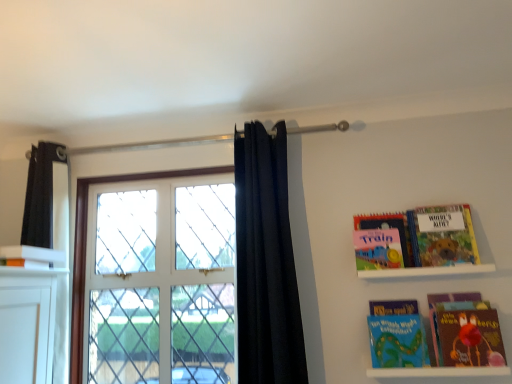
Describe the element at coordinates (266, 262) in the screenshot. The height and width of the screenshot is (384, 512). I see `black fabric curtain at center` at that location.

Where is `matte red book at lower right`? matte red book at lower right is located at coordinates (449, 309).

What do you see at coordinates (382, 241) in the screenshot? I see `matte pink book at upper right, placed as the 2th book when sorted from left to right` at bounding box center [382, 241].

You are a GUI agent. You are given a task and a screenshot of the screen. Output one action in this format:
    pyautogui.click(x=<x>, y=<y>)
    Task: Click on the white glossy book at upper left, which ranks as the 4th book in right-to-left order
    Image resolution: width=512 pixels, height=384 pixels.
    Given the screenshot: What is the action you would take?
    pyautogui.click(x=30, y=256)

How much space does white matte shelf at lower right, marked as the 1th shelf in a bottom-to-top arrangement, occupy horizontally?

It is 4.93 inches.

Locate an element on the screen. This screenshot has height=384, width=512. blue matte bookshelf at lower right, the second book viewed from the right is located at coordinates (397, 335).

Does matte pink book at upper right, placed as the 2th book when sorted from left to right, have a greater height compared to matte red book at lower right?

No.

Is point (398, 248) behind point (464, 309)?

Yes, point (398, 248) is behind point (464, 309).

Considering the relative sizes of matte pink book at upper right, the third book in the right-to-left sequence, and matte red book at lower right in the image provided, is matte pink book at upper right, the third book in the right-to-left sequence, thinner than matte red book at lower right?

Correct, the width of matte pink book at upper right, the third book in the right-to-left sequence, is less than that of matte red book at lower right.

Is matte pink book at upper right, the third book in the right-to-left sequence, at the left side of matte red book at lower right?

Yes.

From a real-world perspective, which object stands above the other?

In real-world perspective, white matte shelf at upper right, the 1th shelf viewed from the top, is above.

Is white matte shelf at upper right, the 1th shelf viewed from the top, positioned behind white matte shelf at lower right, marked as the 1th shelf in a bottom-to-top arrangement?

Yes, white matte shelf at upper right, the 1th shelf viewed from the top, is further from the viewer.

How different are the orientations of white matte shelf at upper right, acting as the second shelf starting from the bottom, and white matte shelf at lower right, the 2th shelf in the top-to-bottom sequence, in degrees?

The angle between the facing direction of white matte shelf at upper right, acting as the second shelf starting from the bottom, and the facing direction of white matte shelf at lower right, the 2th shelf in the top-to-bottom sequence, is 0.00754 degrees.

Identify the location of shelf that appears above the white matte shelf at lower right, the 2th shelf in the top-to-bottom sequence (from a real-world perspective). (426, 271).

Can we say white glass window at center lies outside black fabric curtain at center?

white glass window at center lies outside black fabric curtain at center's area.

Considering the relative positions of white glass window at center and black fabric curtain at center in the image provided, is white glass window at center to the left or to the right of black fabric curtain at center?

white glass window at center is positioned on black fabric curtain at center's left side.

Is white glass window at center positioned before black fabric curtain at center?

No, it is not.

Is white glass window at center with black fabric curtain at center?

No, white glass window at center is not in contact with black fabric curtain at center.

Can you confirm if blue matte bookshelf at lower right, the second book viewed from the right, is positioned to the left of white matte shelf at lower right, the 2th shelf in the top-to-bottom sequence?

Yes, blue matte bookshelf at lower right, the second book viewed from the right, is to the left of white matte shelf at lower right, the 2th shelf in the top-to-bottom sequence.

Where is `shelf below the blue matte bookshelf at lower right, the second book viewed from the right (from the image's perspective)`? The image size is (512, 384). shelf below the blue matte bookshelf at lower right, the second book viewed from the right (from the image's perspective) is located at coordinates (438, 372).

Is blue matte bookshelf at lower right, the second book viewed from the right, touching white matte shelf at lower right, marked as the 1th shelf in a bottom-to-top arrangement?

There is a gap between blue matte bookshelf at lower right, the second book viewed from the right, and white matte shelf at lower right, marked as the 1th shelf in a bottom-to-top arrangement.

Which object is closer to the camera, blue matte bookshelf at lower right, the second book viewed from the right, or white matte shelf at lower right, marked as the 1th shelf in a bottom-to-top arrangement?

white matte shelf at lower right, marked as the 1th shelf in a bottom-to-top arrangement, is more forward.

From a real-world perspective, is white glass window at center positioned over blue matte bookshelf at lower right, the third book from the left, based on gravity?

Correct, in the physical world, white glass window at center is higher than blue matte bookshelf at lower right, the third book from the left.

Which of these two, white glass window at center or blue matte bookshelf at lower right, the second book viewed from the right, is bigger?

white glass window at center.

Can you tell me how much white glass window at center and blue matte bookshelf at lower right, the second book viewed from the right, differ in facing direction?

There is a 0.839-degree angle between the facing directions of white glass window at center and blue matte bookshelf at lower right, the second book viewed from the right.

Does point (79, 334) lie behind point (398, 334)?

Yes, point (79, 334) is farther from viewer.

Which is more distant, (419, 233) or (79, 333)?

Positioned behind is point (79, 333).

I want to click on window that is on the left side of hardcover book at upper right, which is the 1th book from right to left, so click(86, 247).

From the image's perspective, is hardcover book at upper right, which appears as the 4th book when viewed from the left, beneath white glass window at center?

No.

Is hardcover book at upper right, which appears as the 4th book when viewed from the left, to the right of white glass window at center from the viewer's perspective?

Yes, hardcover book at upper right, which appears as the 4th book when viewed from the left, is to the right of white glass window at center.

Who is bigger, blue matte bookshelf at lower right, the second book viewed from the right, or white glossy book at upper left, which ranks as the 4th book in right-to-left order?

With larger size is blue matte bookshelf at lower right, the second book viewed from the right.

Locate an element on the screen. The width and height of the screenshot is (512, 384). book in front of the blue matte bookshelf at lower right, the second book viewed from the right is located at coordinates (30, 256).

From the image's perspective, is blue matte bookshelf at lower right, the second book viewed from the right, on top of white glossy book at upper left, which appears as the 1th book when viewed from the left?

Actually, blue matte bookshelf at lower right, the second book viewed from the right, appears below white glossy book at upper left, which appears as the 1th book when viewed from the left, in the image.

The height and width of the screenshot is (384, 512). Identify the location of book that is the 2nd one when counting upward from the matte red book at lower right (from the image's perspective). (382, 241).

Locate an element on the screen. shelf in front of the white matte shelf at upper right, the 1th shelf viewed from the top is located at coordinates (438, 372).

Looking at the image, which one is located closer to white glossy book at upper left, which appears as the 1th book when viewed from the left, blue matte bookshelf at lower right, the second book viewed from the right, or white glass window at center?

Based on the image, white glass window at center appears to be nearer to white glossy book at upper left, which appears as the 1th book when viewed from the left.

Based on their spatial positions, is white glossy book at upper left, which appears as the 1th book when viewed from the left, or matte pink book at upper right, the third book in the right-to-left sequence, further from white matte shelf at lower right, marked as the 1th shelf in a bottom-to-top arrangement?

The object further to white matte shelf at lower right, marked as the 1th shelf in a bottom-to-top arrangement, is white glossy book at upper left, which appears as the 1th book when viewed from the left.

Considering their positions, is blue matte bookshelf at lower right, the third book from the left, positioned closer to hardcover book at upper right, which appears as the 4th book when viewed from the left, than black fabric curtain at center?

The object closer to hardcover book at upper right, which appears as the 4th book when viewed from the left, is blue matte bookshelf at lower right, the third book from the left.

From the image, which object appears to be nearer to white matte shelf at lower right, the 2th shelf in the top-to-bottom sequence, hardcover book at upper right, which appears as the 4th book when viewed from the left, or white glass window at center?

hardcover book at upper right, which appears as the 4th book when viewed from the left, is positioned closer to the anchor white matte shelf at lower right, the 2th shelf in the top-to-bottom sequence.

Estimate the real-world distances between objects in this image. Which object is further from black fabric curtain at center, white matte shelf at upper right, the 1th shelf viewed from the top, or white glossy book at upper left, which appears as the 1th book when viewed from the left?

Based on the image, white glossy book at upper left, which appears as the 1th book when viewed from the left, appears to be further to black fabric curtain at center.

Looking at the image, which one is located further to white matte shelf at upper right, the 1th shelf viewed from the top, matte red book at lower right or white matte shelf at lower right, marked as the 1th shelf in a bottom-to-top arrangement?

white matte shelf at lower right, marked as the 1th shelf in a bottom-to-top arrangement, lies further to white matte shelf at upper right, the 1th shelf viewed from the top, than the other object.

From the image, which object appears to be farther from white glass window at center, matte red book at lower right or white matte shelf at lower right, the 2th shelf in the top-to-bottom sequence?

The object further to white glass window at center is white matte shelf at lower right, the 2th shelf in the top-to-bottom sequence.

Considering their positions, is white glossy book at upper left, which ranks as the 4th book in right-to-left order, positioned further to white matte shelf at lower right, the 2th shelf in the top-to-bottom sequence, than blue matte bookshelf at lower right, the third book from the left?

Based on the image, white glossy book at upper left, which ranks as the 4th book in right-to-left order, appears to be further to white matte shelf at lower right, the 2th shelf in the top-to-bottom sequence.

Locate an element on the screen. This screenshot has height=384, width=512. shelf between matte pink book at upper right, placed as the 2th book when sorted from left to right, and white matte shelf at lower right, marked as the 1th shelf in a bottom-to-top arrangement, in the vertical direction is located at coordinates (426, 271).

The image size is (512, 384). What are the coordinates of `window between white glossy book at upper left, which appears as the 1th book when viewed from the left, and matte pink book at upper right, the third book in the right-to-left sequence, in the horizontal direction` in the screenshot? It's located at (86, 247).

You are a GUI agent. You are given a task and a screenshot of the screen. Output one action in this format:
    pyautogui.click(x=<x>, y=<y>)
    Task: Click on the book between white matte shelf at upper right, acting as the second shelf starting from the bottom, and white matte shelf at lower right, the 2th shelf in the top-to-bottom sequence, in the up-down direction
    
    Given the screenshot: What is the action you would take?
    pyautogui.click(x=397, y=335)

Locate an element on the screen. Image resolution: width=512 pixels, height=384 pixels. shelf between hardcover book at upper right, which appears as the 4th book when viewed from the left, and white matte shelf at lower right, marked as the 1th shelf in a bottom-to-top arrangement, from top to bottom is located at coordinates (426, 271).